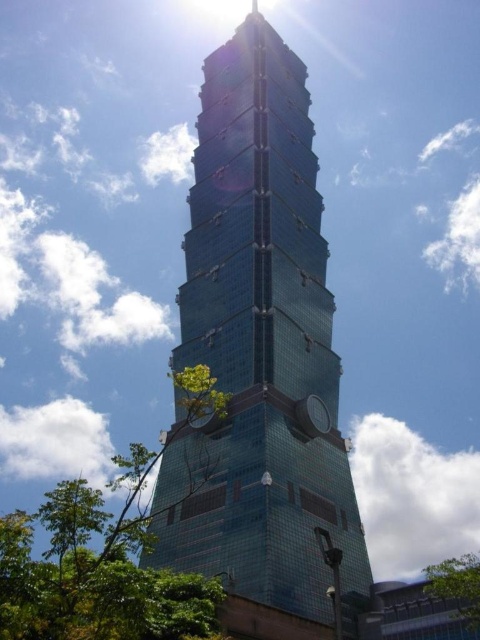
Question: Which point is farther to the camera?

Choices:
 (A) green leafy tree at lower left
 (B) green leafy tree at lower right
 (C) glassy blue skyscraper at center

Answer: (B)

Question: Which point appears closest to the camera in this image?

Choices:
 (A) (456, 588)
 (B) (113, 486)
 (C) (195, 252)

Answer: (A)

Question: Among these objects, which one is nearest to the camera?

Choices:
 (A) green leafy tree at lower right
 (B) glassy blue skyscraper at center

Answer: (B)

Question: Can you confirm if glassy blue skyscraper at center is positioned below green leafy tree at lower left?

Choices:
 (A) no
 (B) yes

Answer: (A)

Question: Is glassy blue skyscraper at center to the left of green leafy tree at lower right from the viewer's perspective?

Choices:
 (A) no
 (B) yes

Answer: (B)

Question: Is glassy blue skyscraper at center further to camera compared to green leafy tree at lower right?

Choices:
 (A) yes
 (B) no

Answer: (B)